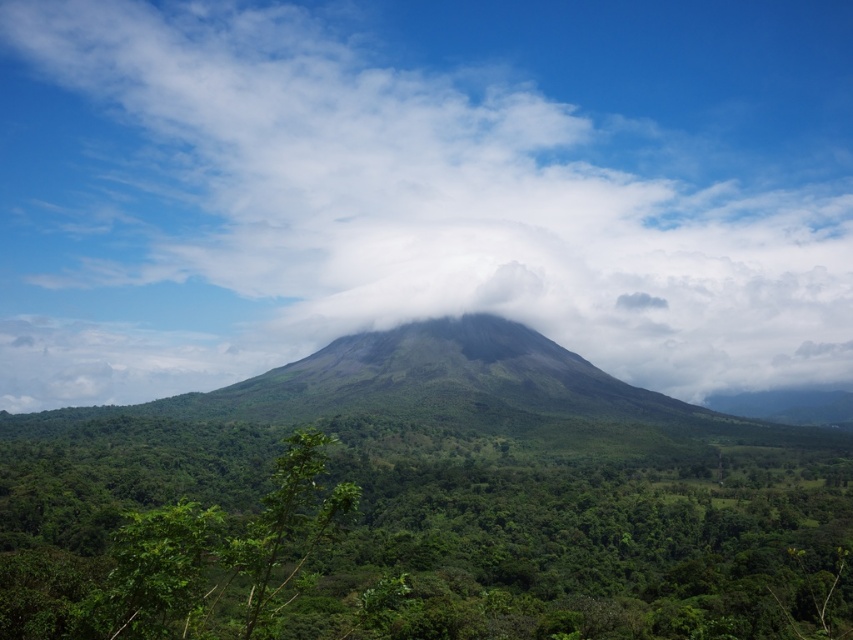
Is white fluffy cloud at center positioned in front of green leafy forest at center?

No, white fluffy cloud at center is further to the viewer.

Between white fluffy cloud at center and green leafy forest at center, which one appears on the left side from the viewer's perspective?

From the viewer's perspective, white fluffy cloud at center appears more on the left side.

Between point (474, 195) and point (161, 461), which one is positioned in front?

Point (161, 461) is more forward.

Where is `white fluffy cloud at center`? The width and height of the screenshot is (853, 640). white fluffy cloud at center is located at coordinates (421, 188).